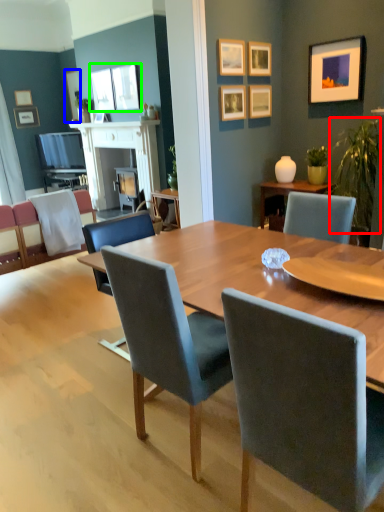
Question: Which is farther away from plant (highlighted by a red box)? picture frame (highlighted by a blue box) or picture frame (highlighted by a green box)?

Choices:
 (A) picture frame
 (B) picture frame

Answer: (A)